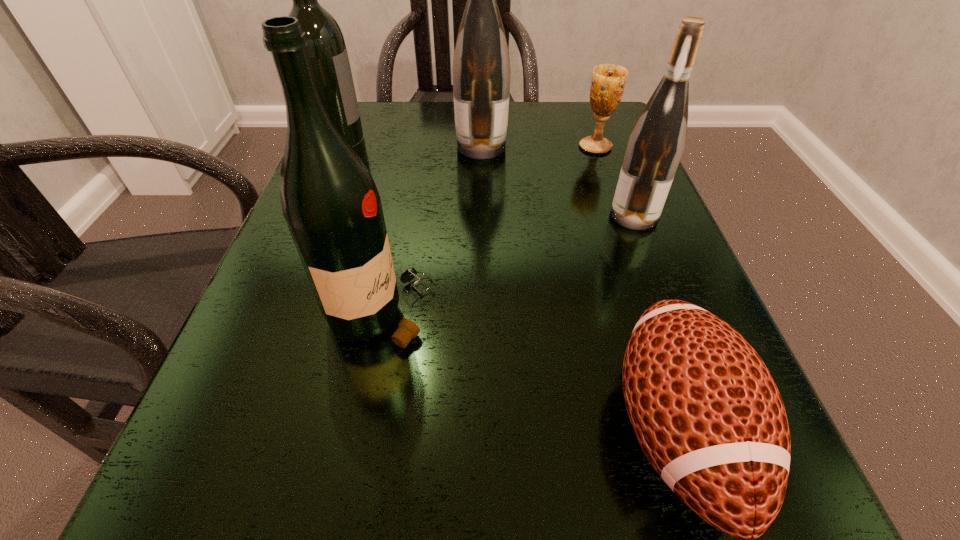
At what (x,y) coordinates should I click in order to perform the action: click on vacant space located 0.240m on the surface of the nearest wine bottle. Please return your answer as a coordinate pair (x, y). Image resolution: width=960 pixels, height=540 pixels. Looking at the image, I should click on (603, 312).

You are a GUI agent. You are given a task and a screenshot of the screen. Output one action in this format:
    pyautogui.click(x=<x>, y=<y>)
    Task: Click on the free spot located on the label of the leftmost object
    Image resolution: width=960 pixels, height=540 pixels.
    Given the screenshot: What is the action you would take?
    pyautogui.click(x=458, y=164)

Identify the location of vacant space located 0.180m on the left of the third farthest wine bottle. The height and width of the screenshot is (540, 960). (508, 215).

In order to click on vacant space located 0.290m on the left of the chalice in this screenshot , I will do `click(442, 147)`.

Find the location of `chalice that is at the far edge`. chalice that is at the far edge is located at coordinates (608, 82).

Find the location of a particular element. This screenshot has width=960, height=540. wine bottle present at the right edge is located at coordinates (656, 143).

Locate an element on the screen. chalice positioned at the right edge is located at coordinates (608, 82).

Find the location of `object present at the far left corner`. object present at the far left corner is located at coordinates (327, 53).

In order to click on object that is at the far right corner in this screenshot , I will do `click(608, 82)`.

This screenshot has height=540, width=960. I want to click on vacant space at the far edge of the desktop, so click(517, 102).